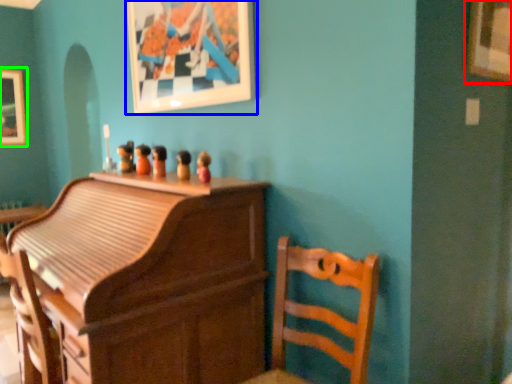
Question: Which is farther away from picture frame (highlighted by a red box)? picture frame (highlighted by a blue box) or picture frame (highlighted by a green box)?

Choices:
 (A) picture frame
 (B) picture frame

Answer: (B)